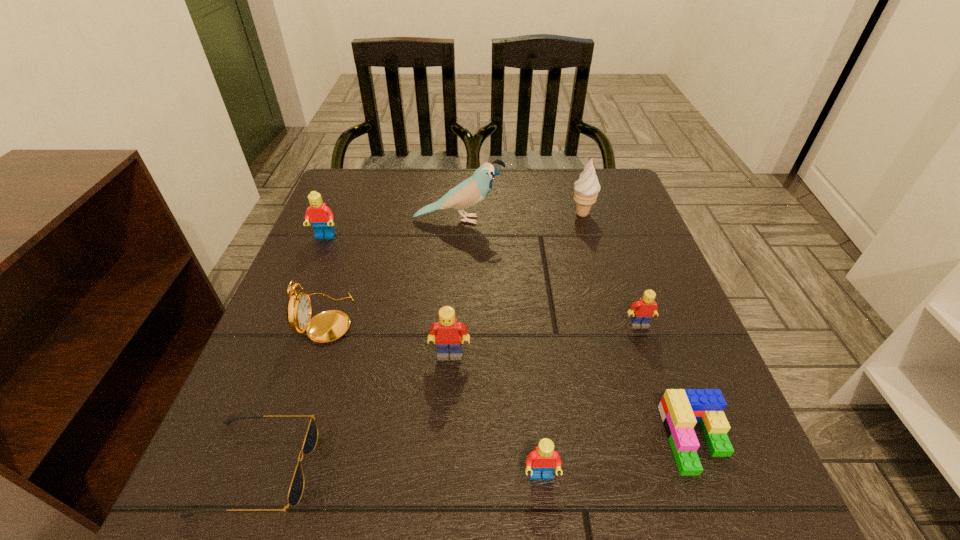
You are a GUI agent. You are given a task and a screenshot of the screen. Output one action in this format:
    pyautogui.click(x=<x>, y=<y>)
    Task: Click on the bird
    This screenshot has width=960, height=540.
    Given the screenshot: What is the action you would take?
    pyautogui.click(x=471, y=191)

Identify the location of icecream. (587, 188).

Locate an element on the screen. The image size is (960, 540). the left red Lego is located at coordinates (321, 217).

You are a GUI agent. You are given a task and a screenshot of the screen. Output one action in this format:
    pyautogui.click(x=<x>, y=<y>)
    Task: Click on the seventh nearest object
    Image resolution: width=960 pixels, height=540 pixels.
    Given the screenshot: What is the action you would take?
    click(x=321, y=217)

Identify the location of the fourth Lego from right to left. The width and height of the screenshot is (960, 540). (447, 332).

The height and width of the screenshot is (540, 960). I want to click on the nearer yellow Lego, so click(447, 332).

This screenshot has width=960, height=540. Identify the location of pocket watch. (327, 326).

You are a GUI agent. You are given a task and a screenshot of the screen. Output one action in this format:
    pyautogui.click(x=<x>, y=<y>)
    Task: Click on the farther yellow Lego
    This screenshot has height=540, width=960.
    Given the screenshot: What is the action you would take?
    pyautogui.click(x=642, y=311)

Where is `the smaller yellow Lego`? the smaller yellow Lego is located at coordinates (642, 311).

This screenshot has height=540, width=960. What are the coordinates of `the nearer red Lego` in the screenshot? It's located at (543, 459).